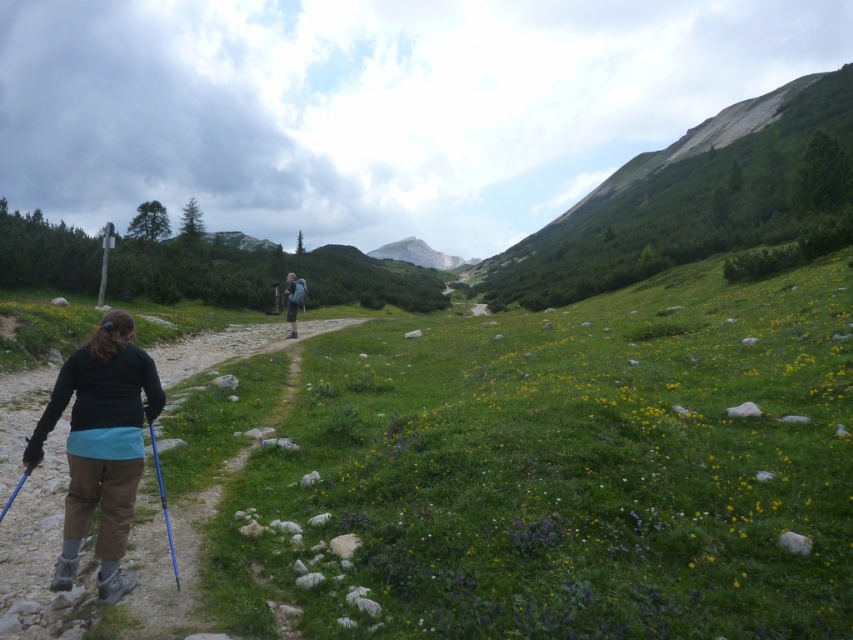
You are a hiker planning to place your matte blue backpack at center on the gravel path at center. Based on the scene, will the backpack be placed on the path or above it?

The gravel path at center is below matte blue backpack at center, so placing the matte blue backpack at center on the gravel path at center would position it above the path.

You are a hiker who has just started your journey and see the blue plastic ski pole at lower left and the matte blue backpack at center. Which object is located to the right of the other?

The blue plastic ski pole at lower left is positioned on the right side of matte blue backpack at center, so the ski pole is to the right of the backpack.

You are a hiker planning to place your matte blue backpack at center on the gravel path at center. Based on the scene, will the backpack be visible from above the path?

The gravel path at center has a lesser height compared to matte blue backpack at center, so the backpack will be visible from above the path since it is taller than the path.